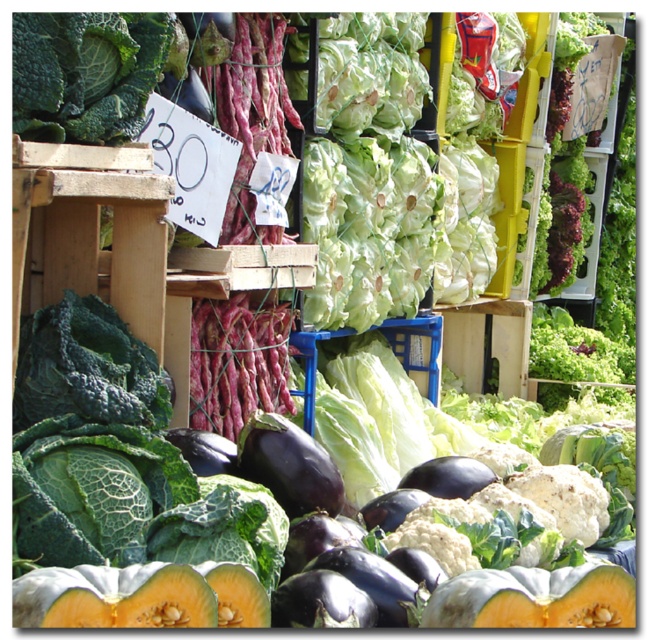
You are a customer at the market stall and want to buy the shiny purple eggplant at center and the smooth orange melon at lower center. If you have a small basket that can only hold one item, which one should you choose based on their size?

The smooth orange melon at lower center is bigger than the shiny purple eggplant at center, so you should choose the shiny purple eggplant at center to fit in your small basket.

From the picture: You are a customer at the market stall and want to place a small basket between the smooth orange melon at lower center and the shiny purple eggplant at center. If the basket is 0.5 meters wide, will it fit between them?

The smooth orange melon at lower center and the shiny purple eggplant at center are 1.60 meters apart, so yes, the basket will fit between them since the distance is greater than the basket width.